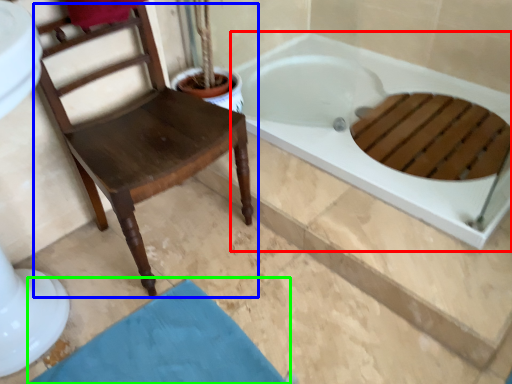
Question: Which object is the farthest from bathtub (highlighted by a red box)? Choose among these: chair (highlighted by a blue box) or bath mat (highlighted by a green box).

Choices:
 (A) chair
 (B) bath mat

Answer: (B)